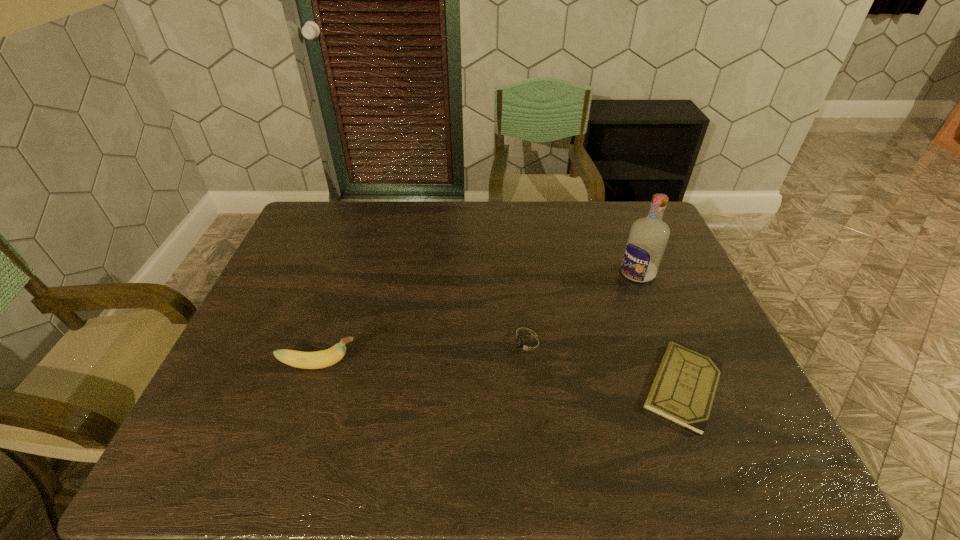
Image resolution: width=960 pixels, height=540 pixels. In order to click on free space that is in between the leftmost object and the second shortest object in this screenshot , I will do `click(424, 354)`.

This screenshot has height=540, width=960. I want to click on free spot between the shortest object and the watch, so click(606, 366).

This screenshot has height=540, width=960. I want to click on vacant space that's between the third tallest object and the checkbook, so click(606, 366).

The height and width of the screenshot is (540, 960). What are the coordinates of `unoccupied area between the banana and the second shortest object` in the screenshot? It's located at (424, 354).

Where is `vacant region between the checkbook and the leftmost object`? The width and height of the screenshot is (960, 540). vacant region between the checkbook and the leftmost object is located at coordinates (501, 376).

This screenshot has width=960, height=540. I want to click on unoccupied area between the tallest object and the third object from right to left, so click(x=583, y=308).

Locate which object ranks third in proximity to the checkbook. Please provide its 2D coordinates. Your answer should be formatted as a tuple, i.e. [(x, y)], where the tuple contains the x and y coordinates of a point satisfying the conditions above.

[(318, 359)]

Where is `object that stands as the second closest to the watch`? Image resolution: width=960 pixels, height=540 pixels. object that stands as the second closest to the watch is located at coordinates (646, 243).

Find the location of a particular element. vacant area that satisfies the following two spatial constraints: 1. on the back side of the third tallest object; 2. on the left side of the farthest object is located at coordinates (520, 273).

The width and height of the screenshot is (960, 540). Find the location of `blank area in the image that satisfies the following two spatial constraints: 1. on the front side of the shortest object; 2. on the right side of the third object from right to left`. blank area in the image that satisfies the following two spatial constraints: 1. on the front side of the shortest object; 2. on the right side of the third object from right to left is located at coordinates (533, 387).